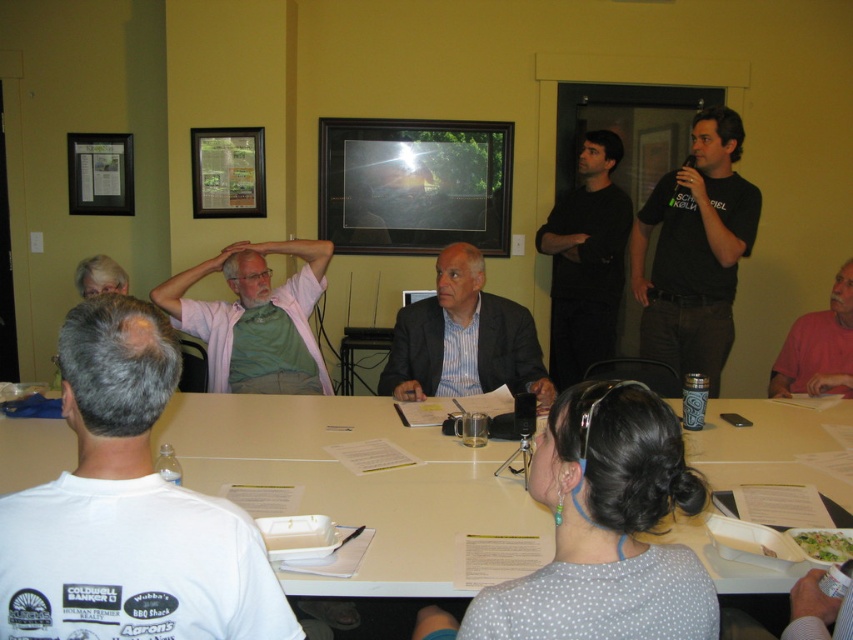
Can you confirm if pink shirt at lower right is positioned to the left of gray hair at upper left?

In fact, pink shirt at lower right is to the right of gray hair at upper left.

Can you confirm if pink shirt at lower right is positioned to the right of gray hair at upper left?

Yes, pink shirt at lower right is to the right of gray hair at upper left.

Which is behind, point (798, 330) or point (82, 262)?

Positioned behind is point (798, 330).

This screenshot has height=640, width=853. In order to click on pink shirt at lower right in this screenshot , I will do `click(817, 348)`.

What do you see at coordinates (355, 483) in the screenshot? I see `white plastic table at center` at bounding box center [355, 483].

Who is more distant from viewer, (x=444, y=593) or (x=85, y=273)?

The point (x=85, y=273) is more distant.

At what (x,y) coordinates should I click in order to perform the action: click on white plastic table at center. Please return your answer as a coordinate pair (x, y). Looking at the image, I should click on (355, 483).

Is point (582, 257) positioned before point (126, 291)?

No, it is behind (126, 291).

Identify the location of black matte shirt at upper center. This screenshot has height=640, width=853. (585, 260).

Which is in front, point (596, 230) or point (102, 273)?

Positioned in front is point (102, 273).

Find the location of `black matte shirt at upper center`. black matte shirt at upper center is located at coordinates (585, 260).